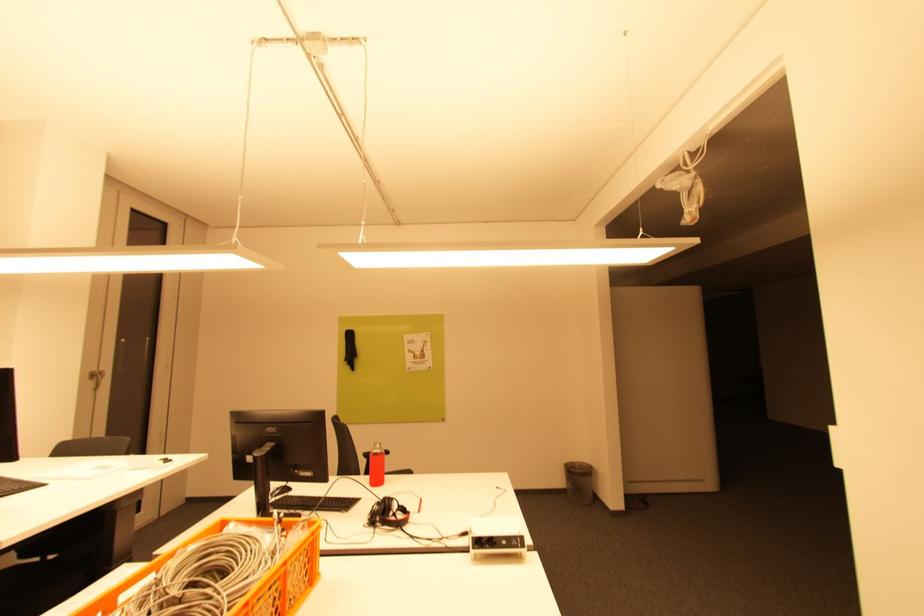
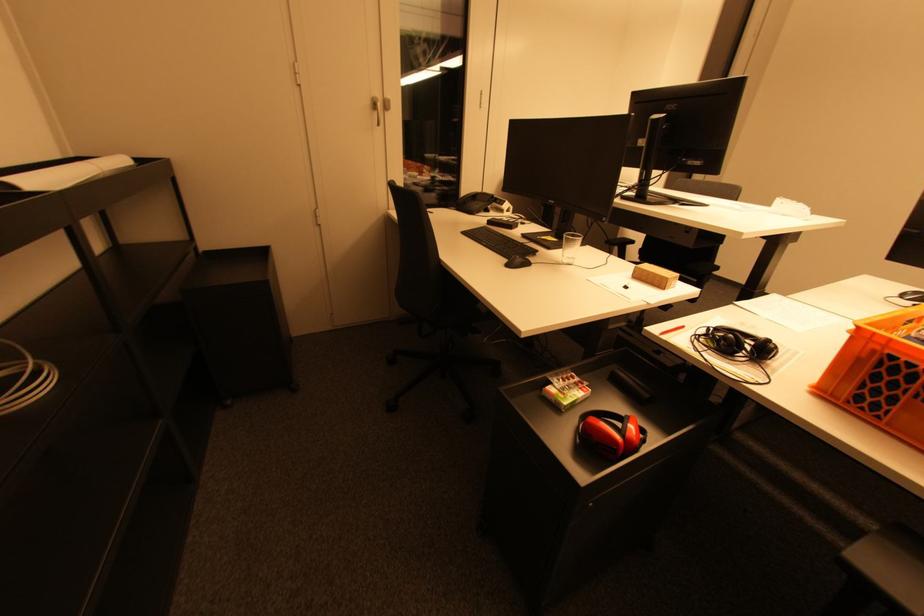
Based on the continuous images, in which direction is the camera rotating?

The camera's rotation is toward left-down.